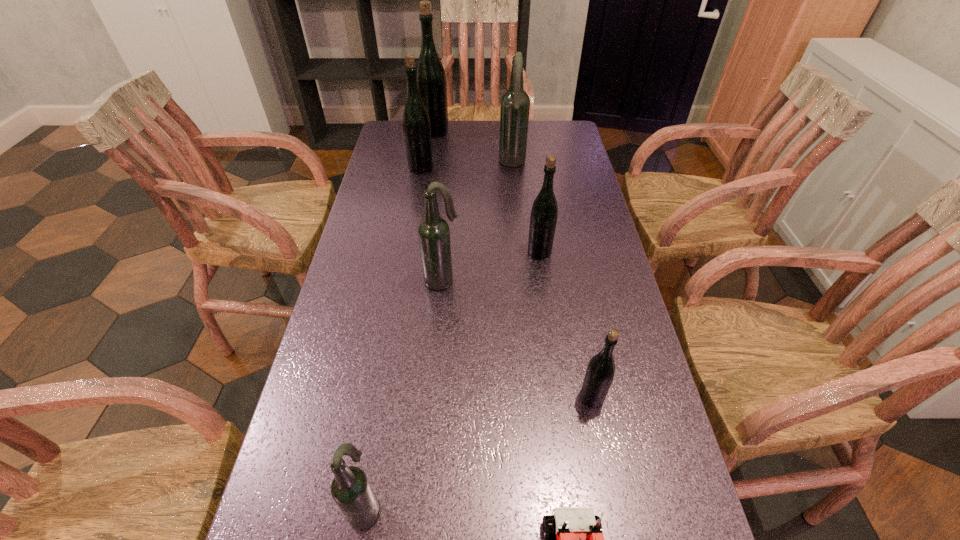
Image resolution: width=960 pixels, height=540 pixels. I want to click on vacant position in the image that satisfies the following two spatial constraints: 1. on the front side of the second biggest dark beer bottle; 2. on the right side of the farthest object, so click(x=413, y=280).